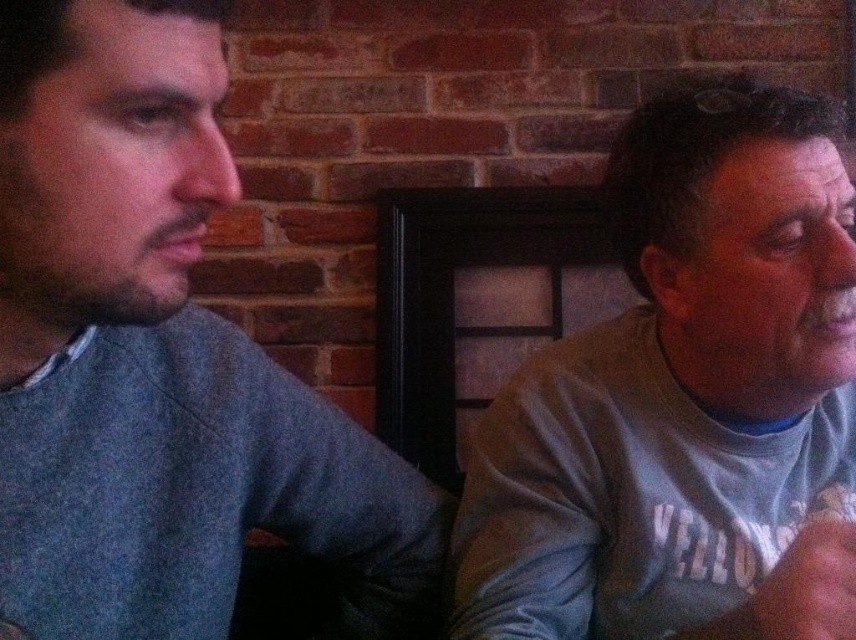
You are a tailor measuring the distance between two people sitting at a table. You need to determine if there is enough space between them to place a 10 inch wide book. The two people are wearing gray cotton shirts, one at left and one at right. Is there enough space between the gray cotton shirt at left and the gray cotton shirt at right to fit the book?

The gray cotton shirt at left is 9.88 inches from gray cotton shirt at right. Since the book is 10 inches wide, the space between them is slightly less than required. Therefore, the book cannot be placed between them.

You are a tailor observing two people in a cafe. You need to determine which gray cotton shirt is shorter between the gray cotton shirt at left and the gray cotton shirt at right. Based on the scene, which one is shorter?

The gray cotton shirt at left is shorter than the gray cotton shirt at right.

You are a photographer standing in front of the gray cotton shirt at left. You want to take a closeup photo of it without getting too close. What is the minimum distance you should maintain to ensure the entire shirt is in frame?

The minimum distance you should maintain is 36.77 centimeters to ensure the entire gray cotton shirt at left is in frame.